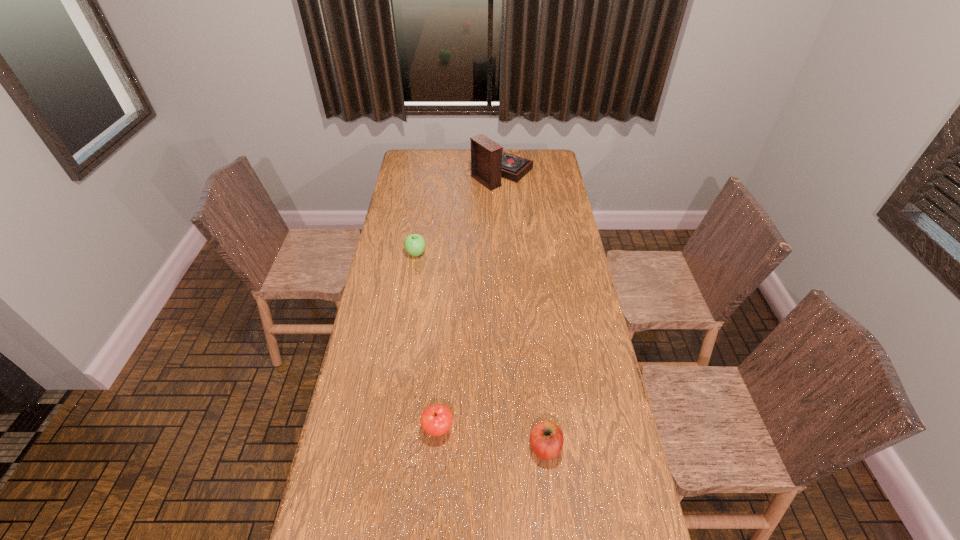
Where is `object present at the far edge`? object present at the far edge is located at coordinates (489, 163).

Where is `object located in the left edge section of the desktop`? The image size is (960, 540). object located in the left edge section of the desktop is located at coordinates (414, 244).

You are a GUI agent. You are given a task and a screenshot of the screen. Output one action in this format:
    pyautogui.click(x=<x>, y=<y>)
    Task: Click on the object positioned at the right edge
    This screenshot has height=540, width=960.
    Given the screenshot: What is the action you would take?
    pyautogui.click(x=489, y=163)

The width and height of the screenshot is (960, 540). I want to click on object that is at the far right corner, so coord(489,163).

In the image, there is a desktop. Where is `vacant area at the far edge`? The width and height of the screenshot is (960, 540). vacant area at the far edge is located at coordinates (470, 163).

Locate an element on the screen. The height and width of the screenshot is (540, 960). vacant space at the left edge is located at coordinates (367, 331).

Find the location of a particular element. This screenshot has width=960, height=540. vacant space at the right edge of the desktop is located at coordinates (559, 203).

In the image, there is a desktop. At what (x,y) coordinates should I click in order to perform the action: click on free space at the far left corner. Please return your answer as a coordinate pair (x, y). Looking at the image, I should click on (412, 171).

At what (x,y) coordinates should I click in order to perform the action: click on free space between the phonograph record and the rightmost apple. Please return your answer as a coordinate pair (x, y). Looking at the image, I should click on (522, 310).

This screenshot has width=960, height=540. I want to click on empty space that is in between the rightmost apple and the second apple from left to right, so click(492, 437).